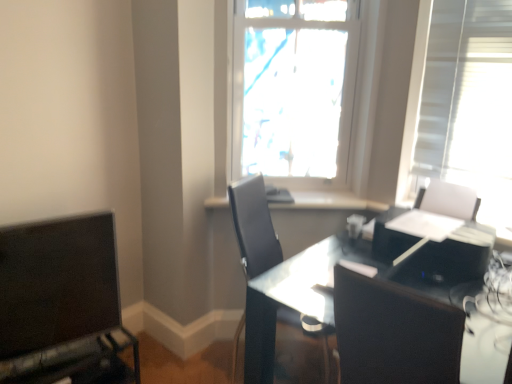
Question: Is matte black monitor at lower left in front of or behind white glossy window sill at center in the image?

Choices:
 (A) front
 (B) behind

Answer: (A)

Question: Considering the positions of matte black monitor at lower left and white glossy window sill at center in the image, is matte black monitor at lower left bigger or smaller than white glossy window sill at center?

Choices:
 (A) small
 (B) big

Answer: (B)

Question: Based on their relative distances, which object is nearer to the white glossy window sill at center?

Choices:
 (A) transparent glass table at center
 (B) black leather chair at center
 (C) transparent glass window at center
 (D) black glossy printer at right
 (E) matte black monitor at lower left

Answer: (B)

Question: Estimate the real-world distances between objects in this image. Which object is closer to the transparent glass window at center?

Choices:
 (A) transparent glass table at center
 (B) black glossy printer at right
 (C) matte black monitor at lower left
 (D) black leather chair at center
 (E) white glossy window sill at center

Answer: (E)